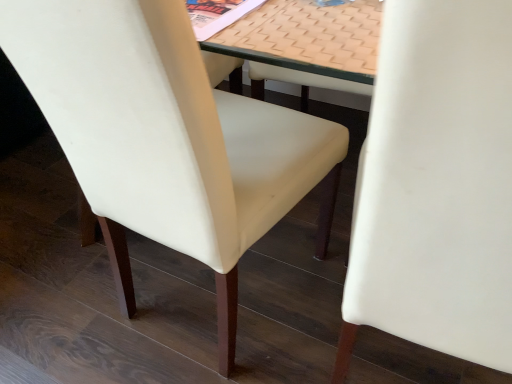
Question: Which direction should I rotate to face white leather chair at center, which is counted as the 2th chair, starting from the left, — up or down?

Choices:
 (A) up
 (B) down

Answer: (B)

Question: Is white leather chair at center, marked as the 2th chair in a right-to-left arrangement, further to the viewer compared to white leather chair at center, which ranks as the 1th chair in right-to-left order?

Choices:
 (A) no
 (B) yes

Answer: (B)

Question: Is white leather chair at center, marked as the first chair in a left-to-right arrangement, shorter than white leather chair at center, which is counted as the 2th chair, starting from the left?

Choices:
 (A) no
 (B) yes

Answer: (B)

Question: Is white leather chair at center, marked as the 2th chair in a right-to-left arrangement, aimed at white leather chair at center, which is counted as the 2th chair, starting from the left?

Choices:
 (A) no
 (B) yes

Answer: (A)

Question: Would you say white leather chair at center, which is counted as the 2th chair, starting from the left, is part of white leather chair at center, marked as the first chair in a left-to-right arrangement,'s contents?

Choices:
 (A) no
 (B) yes

Answer: (A)

Question: Considering the relative positions of white leather chair at center, marked as the 2th chair in a right-to-left arrangement, and white leather chair at center, which ranks as the 1th chair in right-to-left order, in the image provided, is white leather chair at center, marked as the 2th chair in a right-to-left arrangement, to the right of white leather chair at center, which ranks as the 1th chair in right-to-left order, from the viewer's perspective?

Choices:
 (A) yes
 (B) no

Answer: (B)

Question: Is white leather chair at center, which is counted as the 2th chair, starting from the left, at the back of white leather chair at center, marked as the 2th chair in a right-to-left arrangement?

Choices:
 (A) yes
 (B) no

Answer: (B)

Question: Considering the relative positions of beige textured mat at center and white leather chair at center, marked as the first chair in a left-to-right arrangement, in the image provided, is beige textured mat at center to the left of white leather chair at center, marked as the first chair in a left-to-right arrangement, from the viewer's perspective?

Choices:
 (A) yes
 (B) no

Answer: (B)

Question: From a real-world perspective, is beige textured mat at center positioned under white leather chair at center, marked as the 2th chair in a right-to-left arrangement, based on gravity?

Choices:
 (A) yes
 (B) no

Answer: (B)

Question: From a real-world perspective, is beige textured mat at center positioned over white leather chair at center, marked as the 2th chair in a right-to-left arrangement, based on gravity?

Choices:
 (A) no
 (B) yes

Answer: (B)

Question: Considering the relative sizes of beige textured mat at center and white leather chair at center, marked as the 2th chair in a right-to-left arrangement, in the image provided, is beige textured mat at center smaller than white leather chair at center, marked as the 2th chair in a right-to-left arrangement,?

Choices:
 (A) no
 (B) yes

Answer: (B)

Question: Can you confirm if beige textured mat at center is thinner than white leather chair at center, marked as the first chair in a left-to-right arrangement?

Choices:
 (A) no
 (B) yes

Answer: (B)

Question: Does beige textured mat at center have a greater width compared to white leather chair at center, marked as the first chair in a left-to-right arrangement?

Choices:
 (A) yes
 (B) no

Answer: (B)

Question: From the image's perspective, is white leather chair at center, which ranks as the 1th chair in right-to-left order, located above white leather chair at center, marked as the 2th chair in a right-to-left arrangement?

Choices:
 (A) yes
 (B) no

Answer: (B)